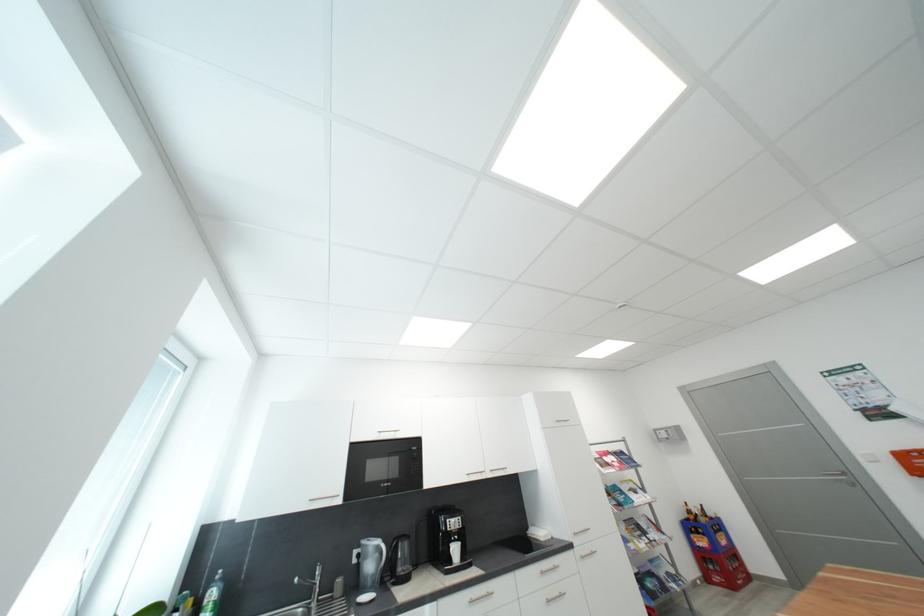
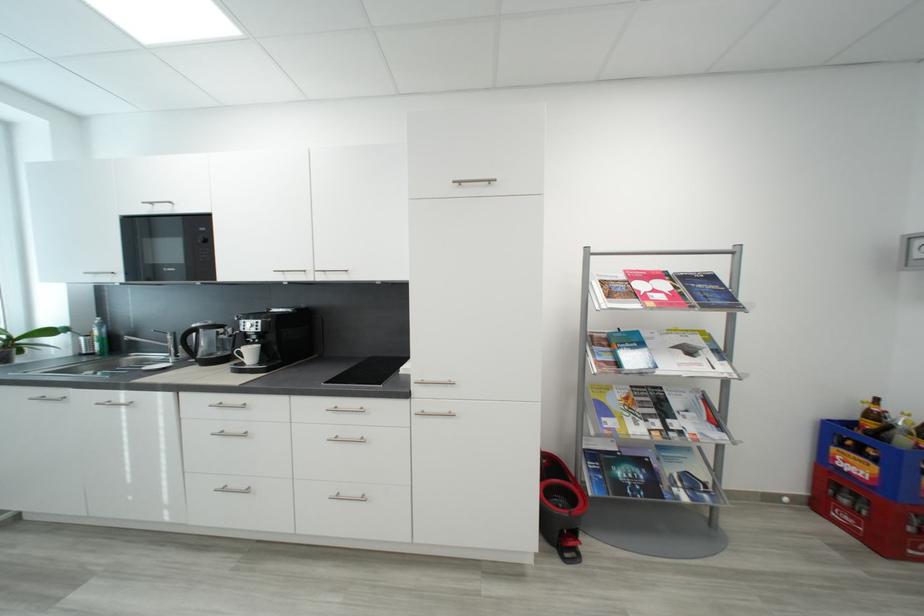
Where in the second image is the point corresponding to (x=697, y=514) from the first image?

(881, 418)